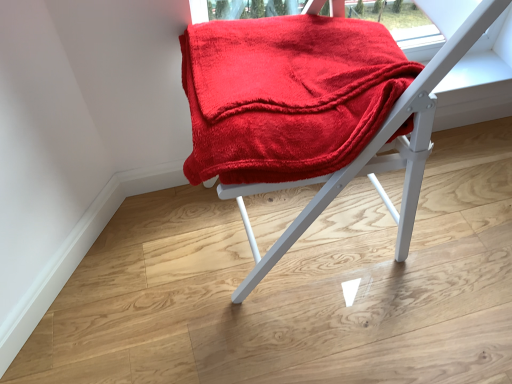
Find the location of a particular element. free space in front of fuzzy red blanket at center is located at coordinates (305, 334).